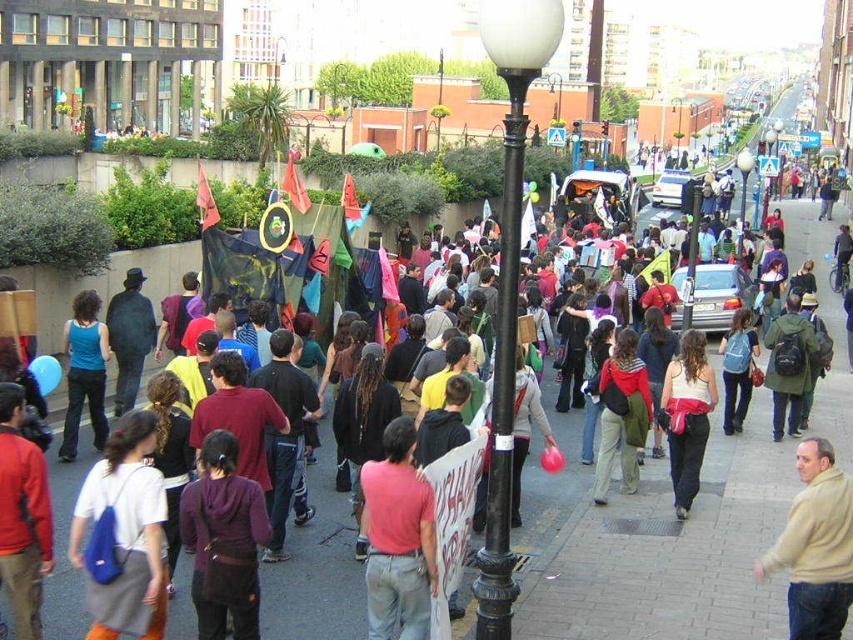
Is pink cotton shirt at center to the left of matte blue tank top at center-left from the viewer's perspective?

In fact, pink cotton shirt at center is to the right of matte blue tank top at center-left.

Is pink cotton shirt at center wider than matte blue tank top at center-left?

No, pink cotton shirt at center is not wider than matte blue tank top at center-left.

Which is behind, point (412, 579) or point (97, 296)?

Point (97, 296)

The width and height of the screenshot is (853, 640). Identify the location of pink cotton shirt at center. (397, 538).

Is the position of matte red sweater at lower left more distant than that of green matte jacket at center?

No, it is not.

From the picture: Is matte red sweater at lower left shorter than green matte jacket at center?

No, matte red sweater at lower left is not shorter than green matte jacket at center.

Locate an element on the screen. Image resolution: width=853 pixels, height=640 pixels. matte red sweater at lower left is located at coordinates (22, 516).

Is beige sweater at lower right further to the viewer compared to dark gray coat at center?

No, it is not.

Is point (833, 456) farther from viewer compared to point (123, 385)?

No, it is in front of (123, 385).

The width and height of the screenshot is (853, 640). I want to click on beige sweater at lower right, so click(815, 545).